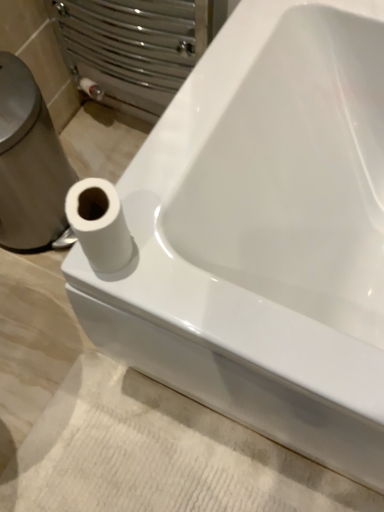
Question: From a real-world perspective, is white glossy toilet paper at left physically above white matte toilet paper at lower left?

Choices:
 (A) no
 (B) yes

Answer: (A)

Question: Is white glossy toilet paper at left bigger than white matte toilet paper at lower left?

Choices:
 (A) yes
 (B) no

Answer: (A)

Question: Can you confirm if white glossy toilet paper at left is shorter than white matte toilet paper at lower left?

Choices:
 (A) no
 (B) yes

Answer: (A)

Question: Can you confirm if white glossy toilet paper at left is positioned to the left of white matte toilet paper at lower left?

Choices:
 (A) no
 (B) yes

Answer: (B)

Question: From the image's perspective, is white glossy toilet paper at left above white matte toilet paper at lower left?

Choices:
 (A) no
 (B) yes

Answer: (B)

Question: Choose the correct answer: Is white glossy toilet paper at left inside white matte toilet paper at lower left or outside it?

Choices:
 (A) outside
 (B) inside

Answer: (A)

Question: Is point (74, 177) closer or farther from the camera than point (94, 231)?

Choices:
 (A) farther
 (B) closer

Answer: (A)

Question: Visually, is white glossy toilet paper at left positioned to the left or to the right of white matte toilet paper at lower left?

Choices:
 (A) right
 (B) left

Answer: (B)

Question: From their relative heights in the image, would you say white glossy toilet paper at left is taller or shorter than white matte toilet paper at lower left?

Choices:
 (A) tall
 (B) short

Answer: (A)

Question: From the image's perspective, is white matte toilet paper at lower left positioned above or below white textured bath mat at lower left?

Choices:
 (A) above
 (B) below

Answer: (A)

Question: In terms of height, does white matte toilet paper at lower left look taller or shorter compared to white textured bath mat at lower left?

Choices:
 (A) short
 (B) tall

Answer: (B)

Question: Is point [104, 216] positioned closer to the camera than point [67, 498]?

Choices:
 (A) farther
 (B) closer

Answer: (B)

Question: Considering the positions of white matte toilet paper at lower left and white textured bath mat at lower left in the image, is white matte toilet paper at lower left wider or thinner than white textured bath mat at lower left?

Choices:
 (A) wide
 (B) thin

Answer: (B)

Question: From the image's perspective, relative to white glossy toilet paper at left, is white matte toilet paper at lower left above or below?

Choices:
 (A) above
 (B) below

Answer: (B)

Question: Looking at the image, does white matte toilet paper at lower left seem bigger or smaller compared to white glossy toilet paper at left?

Choices:
 (A) small
 (B) big

Answer: (A)